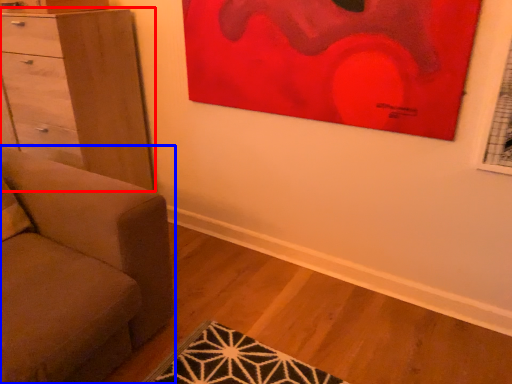
Question: Which of the following is the closest to the observer, chest of drawers (highlighted by a red box) or studio couch (highlighted by a blue box)?

Choices:
 (A) chest of drawers
 (B) studio couch

Answer: (B)